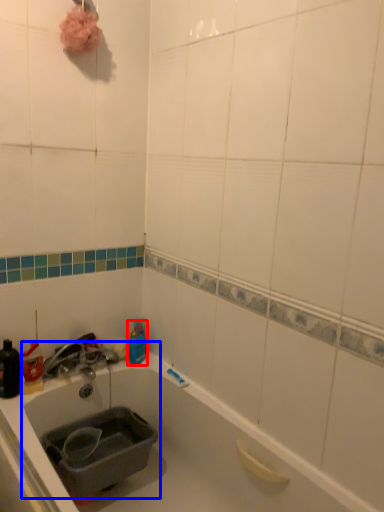
Question: Which point is closer to the camera, bottle (highlighted by a red box) or sink (highlighted by a blue box)?

Choices:
 (A) bottle
 (B) sink

Answer: (B)